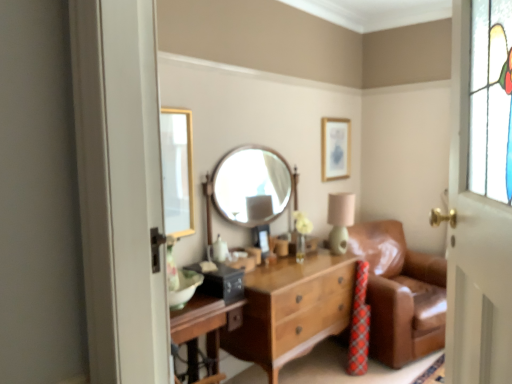
Where is `blank space situated above wooden round mirror at center (from a real-world perspective)`? The image size is (512, 384). blank space situated above wooden round mirror at center (from a real-world perspective) is located at coordinates (250, 145).